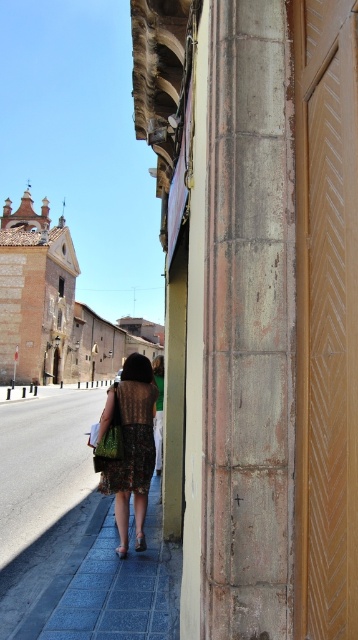
You are an architect designing a new building. You need to ensure that the gray stone column at center does not block the view of the knitted brown dress at center from the main entrance. Given their heights, is this possible?

The gray stone column at center is taller than the knitted brown dress at center, so it may block the view. To ensure visibility, the column could be shortened or positioned further back.

You are standing in the historic European town shown in the image. You want to locate the gray stone column at center. Where would you look in the image?

The gray stone column at center is located at point coordinates of (x=248, y=326).